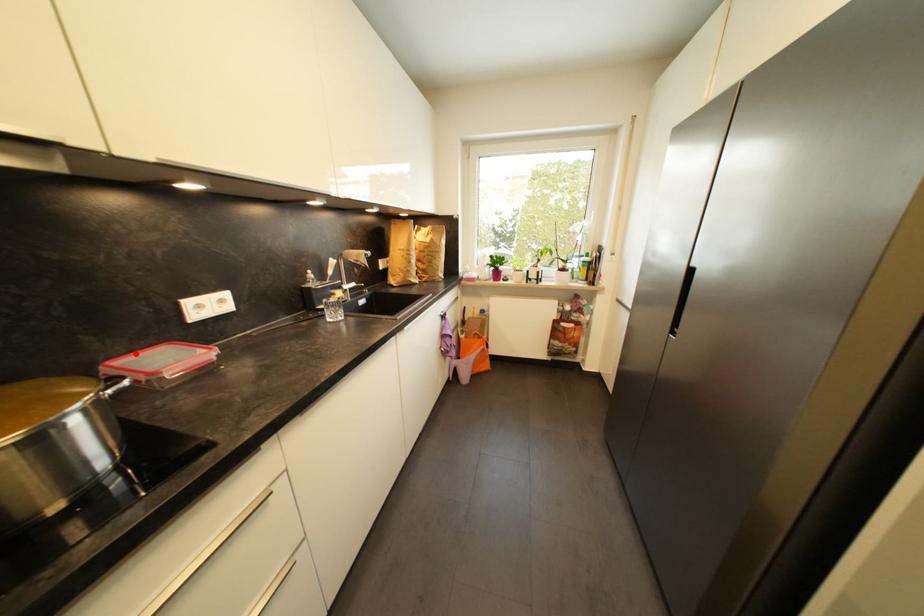
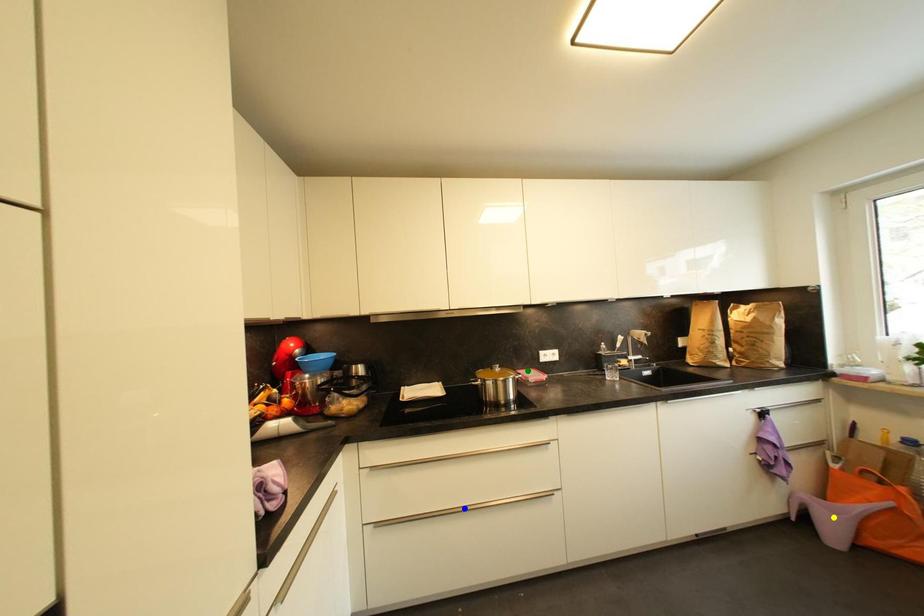
Question: I am providing you with two images of the same scene from different viewpoints. A red point is marked on the first image. You are given multiple points on the second image. Can you choose the point in image 2 that corresponds to the point in image 1?

Choices:
 (A) green point
 (B) blue point
 (C) yellow point

Answer: (A)